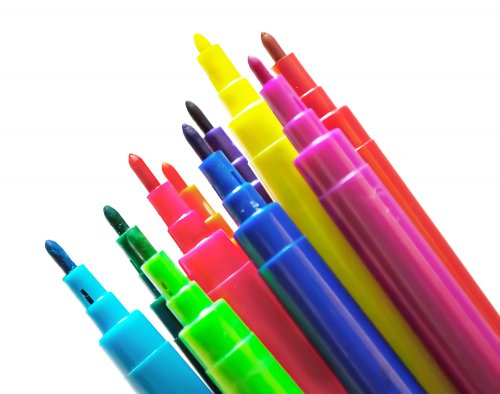
I want to click on differently colored markers, so click(x=335, y=117), click(x=323, y=150), click(x=273, y=148), click(x=234, y=158), click(x=231, y=182), click(x=198, y=204), click(x=182, y=229), click(x=167, y=278), click(x=137, y=264), click(x=102, y=320).